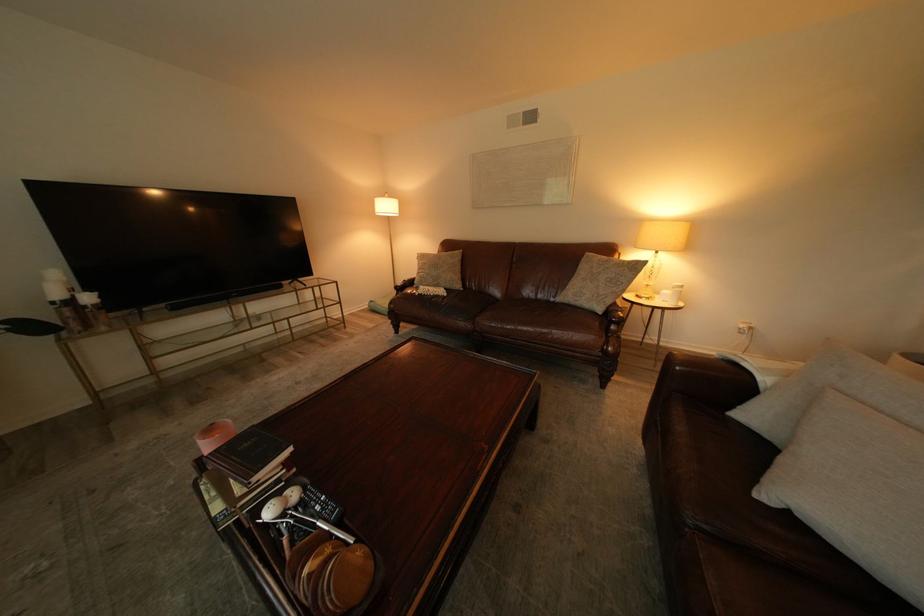
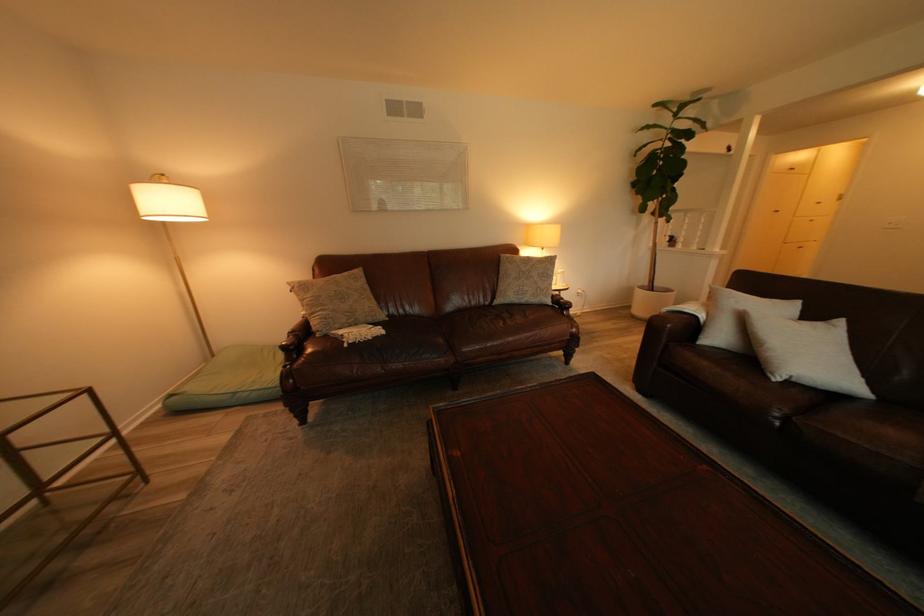
The point at (614, 314) is marked in the first image. Where is the corresponding point in the second image?

(565, 305)